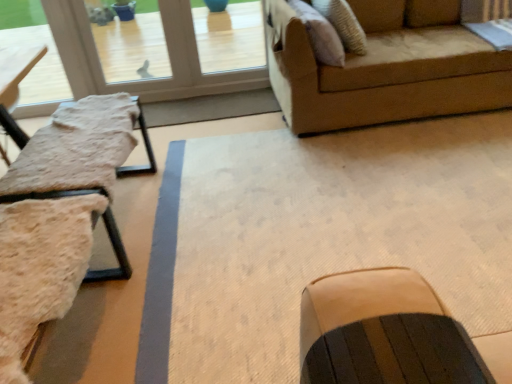
At what (x,y) coordinates should I click in order to perform the action: click on beige fabric swivel chair at left. Please return your answer as a coordinate pair (x, y). Image resolution: width=512 pixels, height=384 pixels. Looking at the image, I should click on (40, 268).

What do you see at coordinates (40, 268) in the screenshot? Image resolution: width=512 pixels, height=384 pixels. I see `beige fabric swivel chair at left` at bounding box center [40, 268].

This screenshot has height=384, width=512. In order to click on fuzzy fabric table at left in this screenshot , I will do `click(114, 252)`.

Locate an element on the screen. Image resolution: width=512 pixels, height=384 pixels. pillow below the dark brown leather rocking chair at center (from a real-world perspective) is located at coordinates (320, 34).

In the scene shown: Does suede-like beige pillow at upper right appear on the left side of dark brown leather rocking chair at center?

No.

Which is closer to the camera, (x=339, y=45) or (x=395, y=310)?

Point (x=339, y=45) appears to be farther away from the viewer than point (x=395, y=310).

Is suede-like beige pillow at upper right facing towards dark brown leather rocking chair at center?

Yes.

Does fuzzy fabric table at left have a larger size compared to dark brown leather rocking chair at center?

Yes, fuzzy fabric table at left is bigger than dark brown leather rocking chair at center.

Is fuzzy fabric table at left positioned with its back to dark brown leather rocking chair at center?

No, fuzzy fabric table at left is not facing away from dark brown leather rocking chair at center.

Between fuzzy fabric table at left and dark brown leather rocking chair at center, which one has less height?

dark brown leather rocking chair at center is shorter.

This screenshot has width=512, height=384. I want to click on rocking chair above the fuzzy fabric table at left (from a real-world perspective), so click(383, 332).

Does dark brown leather rocking chair at center contain fuzzy fabric table at left?

No, dark brown leather rocking chair at center does not contain fuzzy fabric table at left.

Is dark brown leather rocking chair at center turned away from fuzzy fabric table at left?

No, dark brown leather rocking chair at center's orientation is not away from fuzzy fabric table at left.

Is dark brown leather rocking chair at center far from fuzzy fabric table at left?

Absolutely, dark brown leather rocking chair at center is distant from fuzzy fabric table at left.

Considering the positions of objects beige fabric swivel chair at left and transparent glass door at upper left in the image provided, who is behind, beige fabric swivel chair at left or transparent glass door at upper left?

Positioned behind is transparent glass door at upper left.

From the image's perspective, which is above, beige fabric swivel chair at left or transparent glass door at upper left?

From the image's view, transparent glass door at upper left is above.

Is point (22, 272) closer or farther from the camera than point (138, 63)?

Point (22, 272) is positioned closer to the camera compared to point (138, 63).

Is transparent glass door at upper left surrounded by beige fabric swivel chair at left?

No, transparent glass door at upper left is located outside of beige fabric swivel chair at left.

Consider the image. Is transparent glass door at upper left completely or partially outside of suede-like beige pillow at upper right?

transparent glass door at upper left is positioned outside suede-like beige pillow at upper right.

Considering the relative sizes of transparent glass door at upper left and suede-like beige pillow at upper right in the image provided, is transparent glass door at upper left thinner than suede-like beige pillow at upper right?

Yes, transparent glass door at upper left is thinner than suede-like beige pillow at upper right.

From the image's perspective, which one is positioned higher, transparent glass door at upper left or suede-like beige pillow at upper right?

transparent glass door at upper left.

Who is shorter, transparent glass door at upper left or suede-like beige pillow at upper right?

suede-like beige pillow at upper right is shorter.

Is the surface of suede-like beige pillow at upper right in direct contact with beige fabric swivel chair at left?

suede-like beige pillow at upper right and beige fabric swivel chair at left are not in contact.

From the image's perspective, is suede-like beige pillow at upper right positioned above or below beige fabric swivel chair at left?

From the image's perspective, suede-like beige pillow at upper right appears above beige fabric swivel chair at left.

Is beige fabric swivel chair at left completely or partially inside suede-like beige pillow at upper right?

→ No.

Is suede-like beige pillow at upper right outside of fuzzy fabric table at left?

That's correct, suede-like beige pillow at upper right is outside of fuzzy fabric table at left.

From a real-world perspective, between suede-like beige pillow at upper right and fuzzy fabric table at left, who is vertically higher?

suede-like beige pillow at upper right is physically above.

Can you confirm if suede-like beige pillow at upper right is positioned to the right of fuzzy fabric table at left?

Yes.

Identify the location of pillow that appears above the dark brown leather rocking chair at center (from the image's perspective). The width and height of the screenshot is (512, 384). coord(320,34).

Where is `table that appears behind the dark brown leather rocking chair at center`? This screenshot has height=384, width=512. table that appears behind the dark brown leather rocking chair at center is located at coordinates (114, 252).

Looking at the image, which one is located further to beige fabric swivel chair at left, dark brown leather rocking chair at center or fuzzy fabric table at left?

Based on the image, dark brown leather rocking chair at center appears to be further to beige fabric swivel chair at left.

Looking at the image, which one is located closer to dark brown leather rocking chair at center, fuzzy fabric table at left or transparent glass door at upper left?

The object closer to dark brown leather rocking chair at center is fuzzy fabric table at left.

Based on their spatial positions, is beige fabric swivel chair at left or transparent glass door at upper left further from fuzzy fabric table at left?

transparent glass door at upper left.

Which object lies further to the anchor point fuzzy fabric table at left, suede-like beige pillow at upper right or beige fabric swivel chair at left?

suede-like beige pillow at upper right.

When comparing their distances from fuzzy fabric table at left, does dark brown leather rocking chair at center or suede-like beige pillow at upper right seem further?

suede-like beige pillow at upper right.

Which object lies nearer to the anchor point dark brown leather rocking chair at center, suede-like beige pillow at upper right or beige fabric swivel chair at left?

beige fabric swivel chair at left is closer to dark brown leather rocking chair at center.

Estimate the real-world distances between objects in this image. Which object is further from dark brown leather rocking chair at center, suede-like beige pillow at upper right or transparent glass door at upper left?

transparent glass door at upper left.

From the image, which object appears to be nearer to fuzzy fabric table at left, dark brown leather rocking chair at center or transparent glass door at upper left?

dark brown leather rocking chair at center is positioned closer to the anchor fuzzy fabric table at left.

Find the location of a particular element. The height and width of the screenshot is (384, 512). swivel chair located between fuzzy fabric table at left and suede-like beige pillow at upper right in the left-right direction is located at coordinates [x=40, y=268].

Locate an element on the screen. pillow located between beige fabric swivel chair at left and transparent glass door at upper left in the depth direction is located at coordinates (320, 34).

At what (x,y) coordinates should I click in order to perform the action: click on swivel chair positioned between dark brown leather rocking chair at center and transparent glass door at upper left from near to far. Please return your answer as a coordinate pair (x, y). Image resolution: width=512 pixels, height=384 pixels. Looking at the image, I should click on [x=40, y=268].

Find the location of `swivel chair between fuzzy fabric table at left and dark brown leather rocking chair at center`. swivel chair between fuzzy fabric table at left and dark brown leather rocking chair at center is located at coordinates (40, 268).